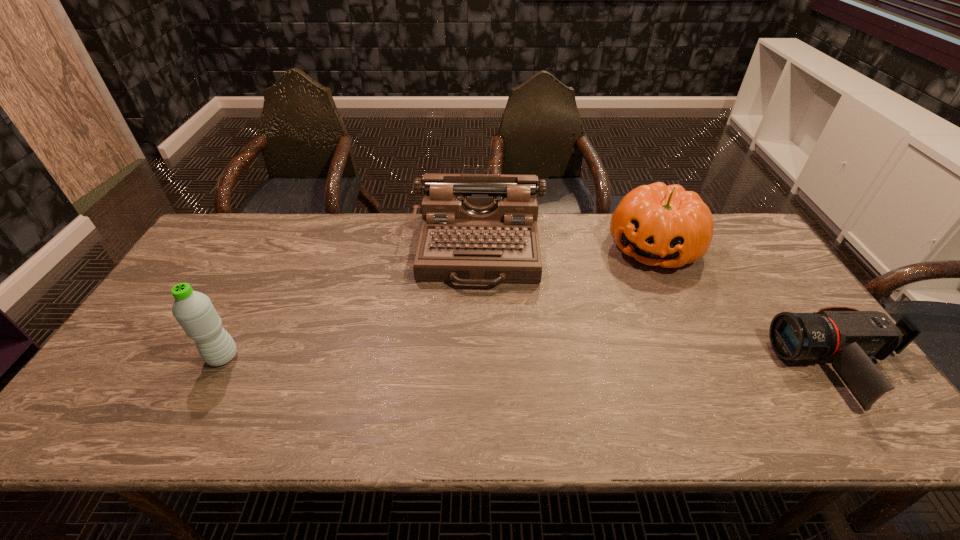
This screenshot has width=960, height=540. I want to click on the leftmost object, so click(x=194, y=311).

Where is `camcorder`? The height and width of the screenshot is (540, 960). camcorder is located at coordinates (851, 339).

This screenshot has height=540, width=960. In order to click on the rightmost object in this screenshot , I will do `click(851, 339)`.

What are the coordinates of `typewriter` in the screenshot? It's located at (478, 229).

At what (x,y) coordinates should I click in order to perform the action: click on pumpkin. Please return your answer as a coordinate pair (x, y). The width and height of the screenshot is (960, 540). Looking at the image, I should click on (657, 224).

At what (x,y) coordinates should I click in order to perform the action: click on free space located on the right of the leftmost object. Please return your answer as a coordinate pair (x, y). Looking at the image, I should click on (267, 357).

I want to click on vacant space located 0.350m on the lens of the camcorder, so click(639, 367).

Locate an element on the screen. vacant space located on the lens of the camcorder is located at coordinates (688, 367).

Where is `vacant area located on the lens of the camcorder`? The width and height of the screenshot is (960, 540). vacant area located on the lens of the camcorder is located at coordinates (709, 367).

Locate an element on the screen. The width and height of the screenshot is (960, 540). vacant region located 0.120m on the keyboard of the second object from left to right is located at coordinates (475, 324).